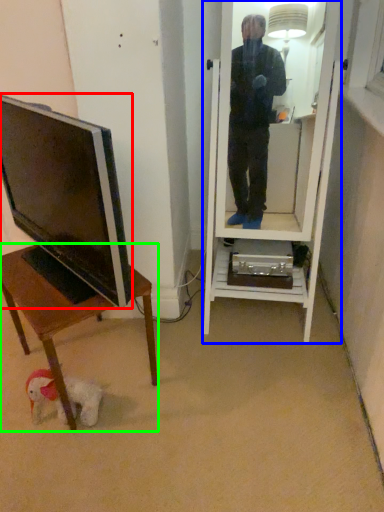
Question: Which is farther away from television (highlighted by a red box)? mirror (highlighted by a blue box) or desk (highlighted by a green box)?

Choices:
 (A) mirror
 (B) desk

Answer: (A)